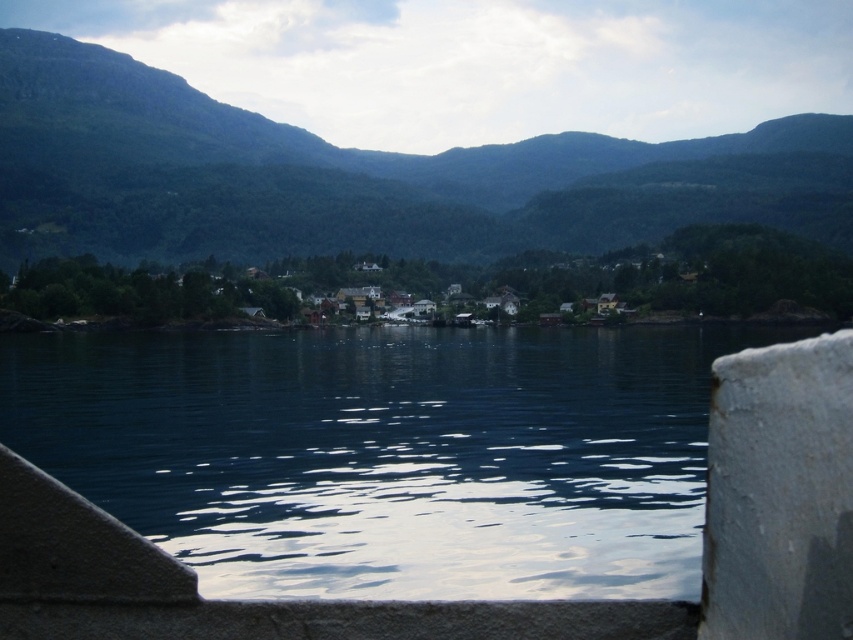
Does point (689, 403) come closer to viewer compared to point (602, 188)?

Yes, point (689, 403) is closer to viewer.

Can you confirm if dark blue water at center is wider than green forested mountain at upper center?

No.

Which is behind, point (334, 472) or point (288, 161)?

Point (288, 161)

Locate an element on the screen. Image resolution: width=853 pixels, height=640 pixels. dark blue water at center is located at coordinates (387, 452).